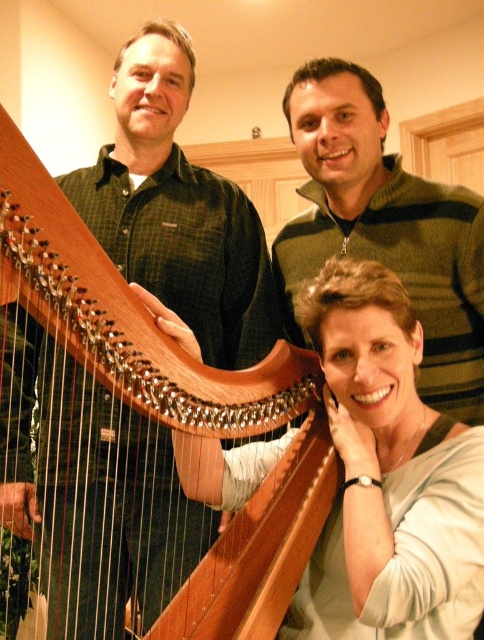
Which of these two, matte white shirt at center or green striped sweater at upper right, stands taller?

Standing taller between the two is green striped sweater at upper right.

Is matte white shirt at center smaller than green striped sweater at upper right?

Indeed, matte white shirt at center has a smaller size compared to green striped sweater at upper right.

Who is more distant from viewer, (347,284) or (437,384)?

The point (437,384) is more distant.

Locate an element on the screen. matte white shirt at center is located at coordinates (383, 468).

Who is more distant from viewer, (438, 262) or (270, 568)?

Point (438, 262)

Who is higher up, green striped sweater at upper right or wooden harp at center?

green striped sweater at upper right is above.

Find the location of `green striped sweater at upper right`. green striped sweater at upper right is located at coordinates [386, 227].

Is matte white shirt at center wider than wooden harp at center?

No.

Which is more to the right, matte white shirt at center or wooden harp at center?

From the viewer's perspective, matte white shirt at center appears more on the right side.

Image resolution: width=484 pixels, height=640 pixels. What do you see at coordinates (383, 468) in the screenshot?
I see `matte white shirt at center` at bounding box center [383, 468].

Where is `matte white shirt at center`? matte white shirt at center is located at coordinates (383, 468).